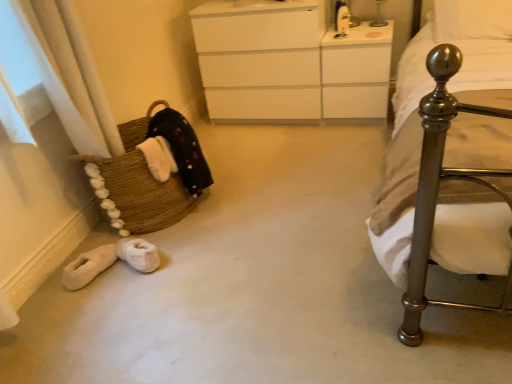
Identify the location of free space between white matte chest of drawers at center and brown woven basket at left. (247, 155).